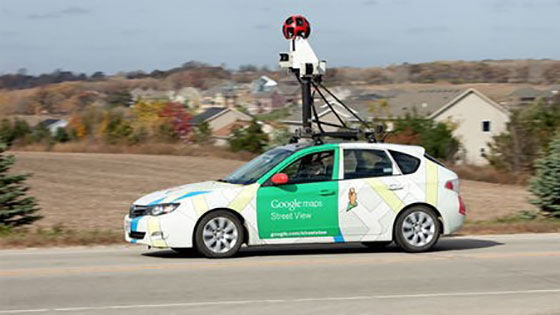
The height and width of the screenshot is (315, 560). Find the location of `pictures`. pictures is located at coordinates (328, 173).